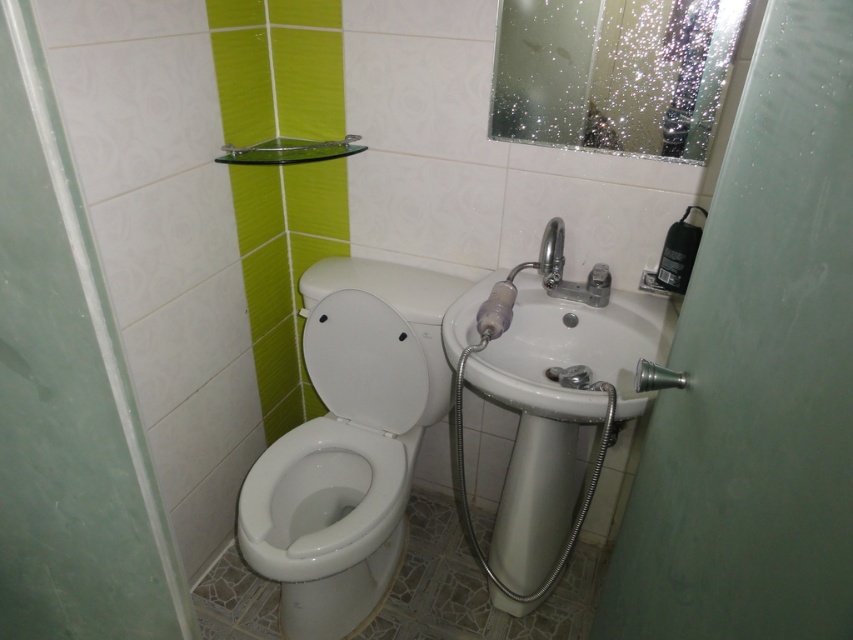
Between point (552, 288) and point (671, 387), which one is positioned behind?

The point (552, 288) is more distant.

Between polished chrome faucet at upper right and matte silver shower head at lower right, which one has more height?

With more height is polished chrome faucet at upper right.

At what (x,y) coordinates should I click in order to perform the action: click on polished chrome faucet at upper right. Please return your answer as a coordinate pair (x, y). The width and height of the screenshot is (853, 640). Looking at the image, I should click on (550, 253).

Which is more to the right, white glossy toilet at lower left or white glossy bidet at center?

From the viewer's perspective, white glossy toilet at lower left appears more on the right side.

Can you confirm if white glossy toilet at lower left is bigger than white glossy bidet at center?

Yes.

At what (x,y) coordinates should I click in order to perform the action: click on white glossy toilet at lower left. Please return your answer as a coordinate pair (x, y). Looking at the image, I should click on (349, 444).

Measure the distance between point (370, 326) and camera.

A distance of 1.63 meters exists between point (370, 326) and camera.

Does white glossy toilet at lower left appear under polished chrome faucet at upper right?

Indeed, white glossy toilet at lower left is positioned under polished chrome faucet at upper right.

Who is more forward, (x=355, y=330) or (x=552, y=237)?

Point (x=552, y=237) is more forward.

This screenshot has width=853, height=640. Find the location of `white glossy toilet at lower left`. white glossy toilet at lower left is located at coordinates (349, 444).